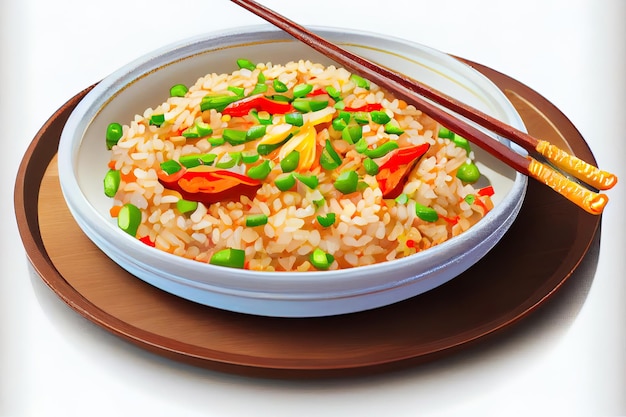
At what (x,y) coordinates should I click in order to perform the action: click on space to left of plate. Please return your answer as a coordinate pair (x, y). This screenshot has height=417, width=626. Looking at the image, I should click on (3, 207).